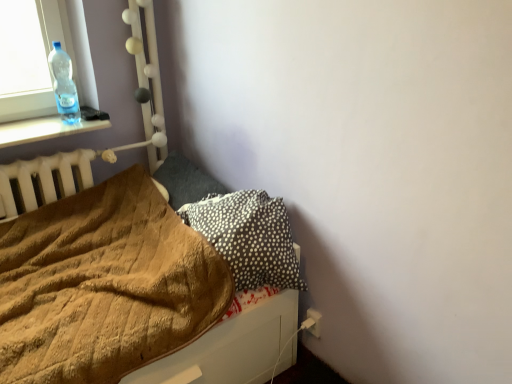
Question: Does brown fuzzy blanket at lower left come in front of black dotted pillow at lower right, marked as the 1th pillow in a front-to-back arrangement?

Choices:
 (A) no
 (B) yes

Answer: (B)

Question: Is brown fuzzy blanket at lower left positioned beyond the bounds of black dotted pillow at lower right, acting as the 2th pillow starting from the back?

Choices:
 (A) no
 (B) yes

Answer: (B)

Question: From a real-world perspective, is brown fuzzy blanket at lower left positioned over black dotted pillow at lower right, marked as the 1th pillow in a front-to-back arrangement, based on gravity?

Choices:
 (A) yes
 (B) no

Answer: (B)

Question: Can you confirm if brown fuzzy blanket at lower left is positioned to the left of black dotted pillow at lower right, acting as the 2th pillow starting from the back?

Choices:
 (A) yes
 (B) no

Answer: (A)

Question: Is brown fuzzy blanket at lower left thinner than black dotted pillow at lower right, acting as the 2th pillow starting from the back?

Choices:
 (A) yes
 (B) no

Answer: (B)

Question: Does brown fuzzy blanket at lower left have a larger size compared to black dotted pillow at lower right, marked as the 1th pillow in a front-to-back arrangement?

Choices:
 (A) no
 (B) yes

Answer: (B)

Question: Is black dotted pillow at lower right, marked as the 1th pillow in a front-to-back arrangement, with brown fuzzy blanket at lower left?

Choices:
 (A) no
 (B) yes

Answer: (A)

Question: Considering the relative positions of black dotted pillow at lower right, marked as the 1th pillow in a front-to-back arrangement, and brown fuzzy blanket at lower left in the image provided, is black dotted pillow at lower right, marked as the 1th pillow in a front-to-back arrangement, to the right of brown fuzzy blanket at lower left from the viewer's perspective?

Choices:
 (A) yes
 (B) no

Answer: (A)

Question: Is black dotted pillow at lower right, acting as the 2th pillow starting from the back, shorter than brown fuzzy blanket at lower left?

Choices:
 (A) yes
 (B) no

Answer: (A)

Question: Does black dotted pillow at lower right, marked as the 1th pillow in a front-to-back arrangement, have a greater height compared to brown fuzzy blanket at lower left?

Choices:
 (A) yes
 (B) no

Answer: (B)

Question: Can we say black dotted pillow at lower right, acting as the 2th pillow starting from the back, lies outside brown fuzzy blanket at lower left?

Choices:
 (A) yes
 (B) no

Answer: (A)

Question: From the image's perspective, would you say black dotted pillow at lower right, acting as the 2th pillow starting from the back, is shown under brown fuzzy blanket at lower left?

Choices:
 (A) no
 (B) yes

Answer: (A)

Question: Considering the relative sizes of transparent plastic bottle at upper left and brown fuzzy blanket at lower left in the image provided, is transparent plastic bottle at upper left wider than brown fuzzy blanket at lower left?

Choices:
 (A) no
 (B) yes

Answer: (A)